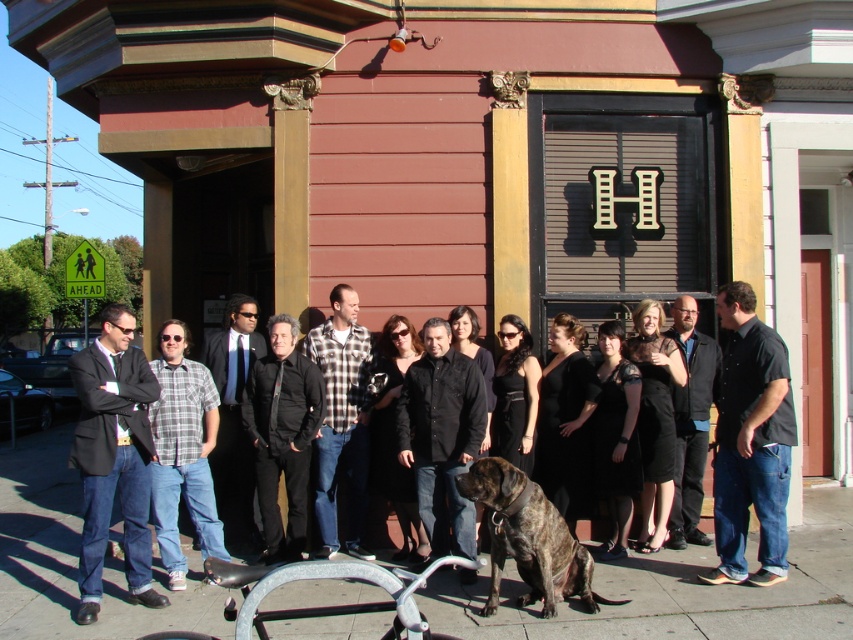
Consider the image. You are standing in front of the building and see a group of people. There is a point at coordinate (341, 420). Which object does this point belong to?

The point at coordinate (341, 420) belongs to the plaid flannel shirt at center.

You are a photographer taking a group photo of the plaid flannel shirt at center and the black suit at center. Which person should you adjust to ensure both are fully visible in the frame?

The plaid flannel shirt at center is located above the black suit at center, so you should lower the camera angle slightly to ensure both are fully visible in the frame.

You are a photographer taking a group photo of the plaid flannel shirt at center and the black suit at center. Which person should you move to the left to make them stand side by side?

The plaid flannel shirt at center is to the right of black suit at center, so you should move the plaid flannel shirt at center to the left to align them side by side.